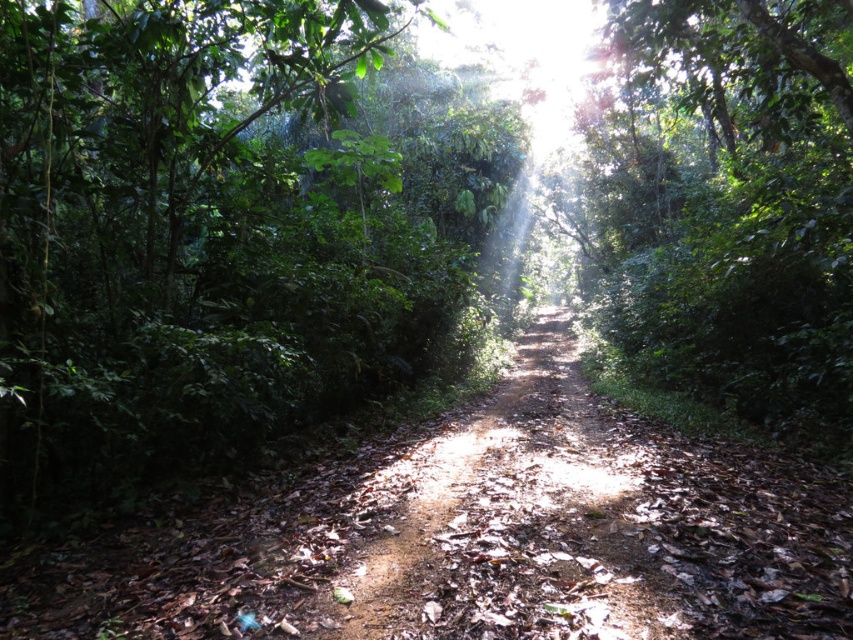
You are standing at the entrance of the forest path and want to walk towards the green leafy tree at center. Which direction should you head in order to reach it?

The green leafy tree at center is located at the coordinates 0.325 on the x axis and 0.860 on the y axis, so you should head in the direction of those coordinates to reach it.

You are a hiker walking along the dirt path at center and want to take a photo of the green leafy tree at center. Since the tree is taller than the path, where should you position yourself to ensure the entire tree fits in your camera frame?

Since the green leafy tree at center is taller than the dirt path at center, you should position yourself further back from the tree to ensure the entire tree fits in your camera frame.

You are a hiker walking along the dirt path at center and want to take a photo of the green leafy tree at center. In which direction should you move to get the tree in your camera frame?

The green leafy tree at center is to the right of the dirt path at center, so you should move to the right side of the dirt path at center to get the tree in your camera frame.